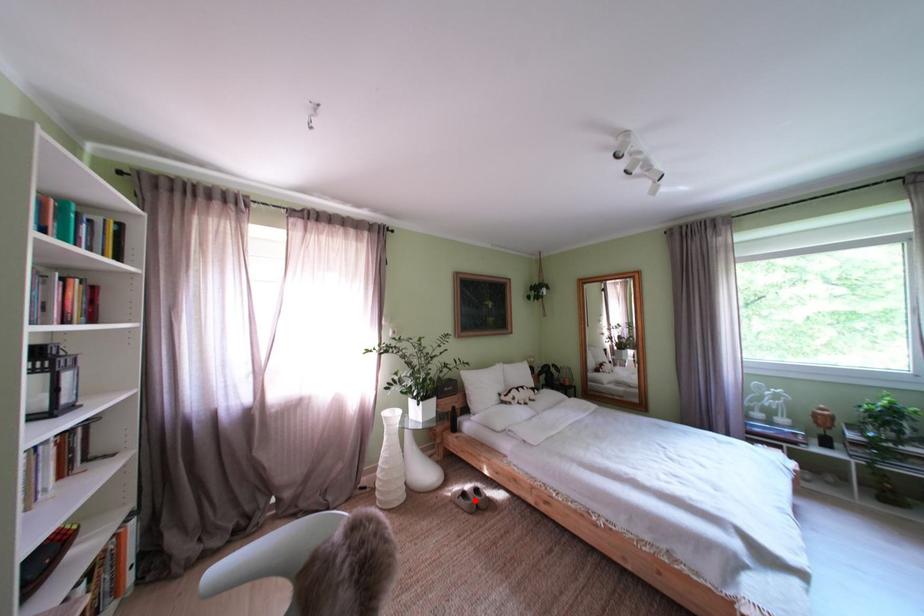
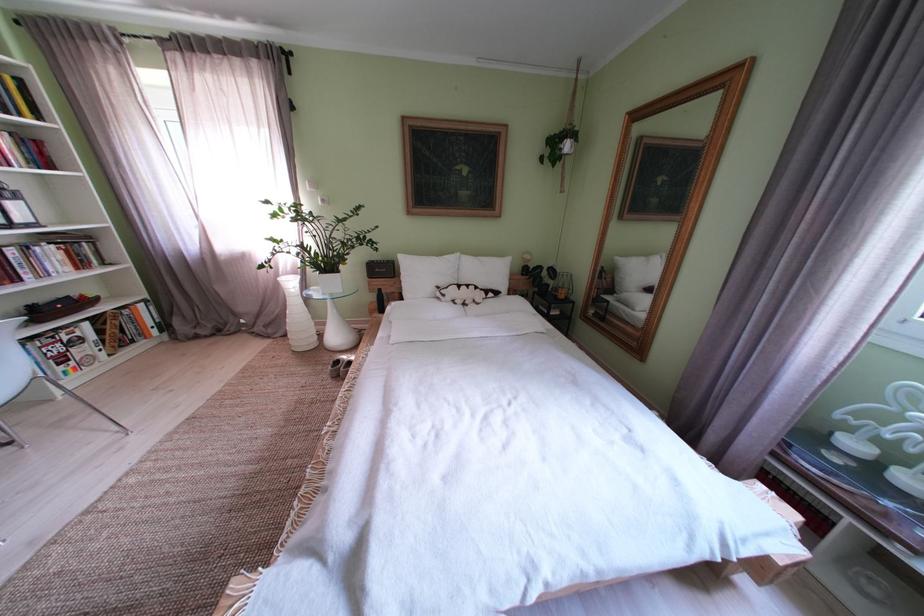
The point at the highlighted location is marked in the first image. Where is the corresponding point in the second image?

(348, 367)